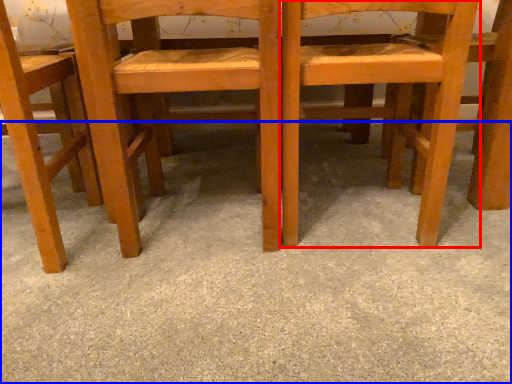
Question: Which object appears farthest to the camera in this image, chair (highlighted by a red box) or concrete (highlighted by a blue box)?

Choices:
 (A) chair
 (B) concrete

Answer: (A)